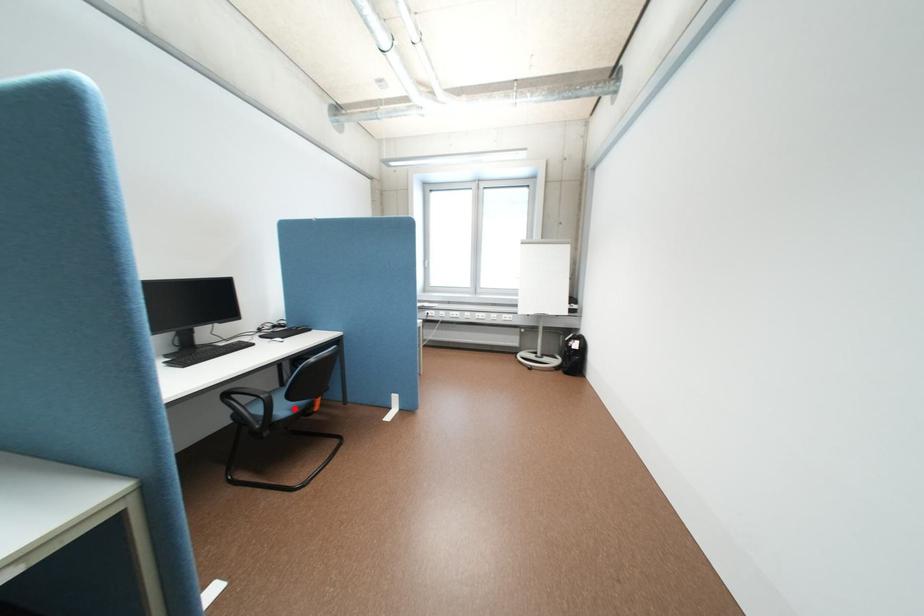
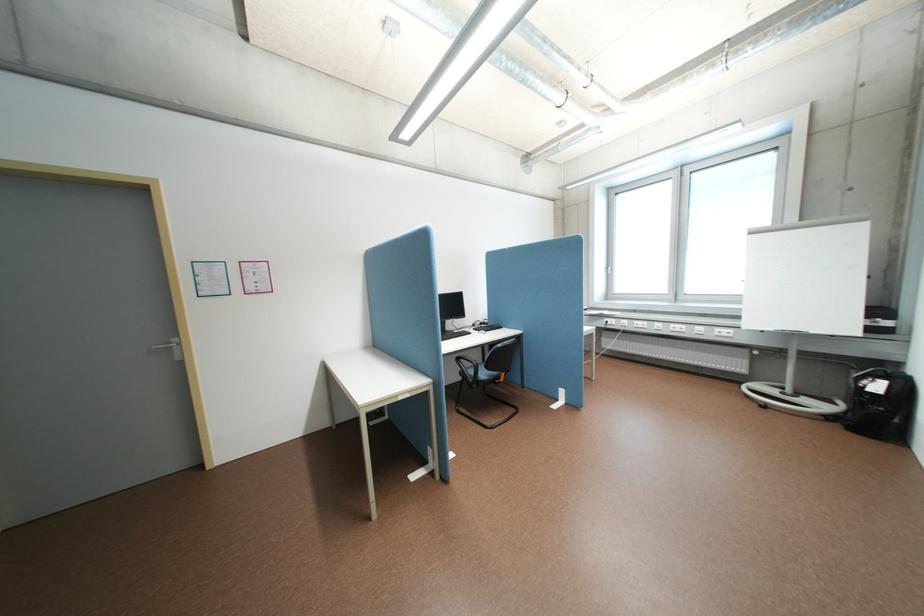
Question: I am providing you with two images of the same scene from different viewpoints. Image1 has a red point marked. In image2, the corresponding 3D location appears at what relative position? Reply with the corresponding letter.

Choices:
 (A) Closer
 (B) Farther

Answer: (A)